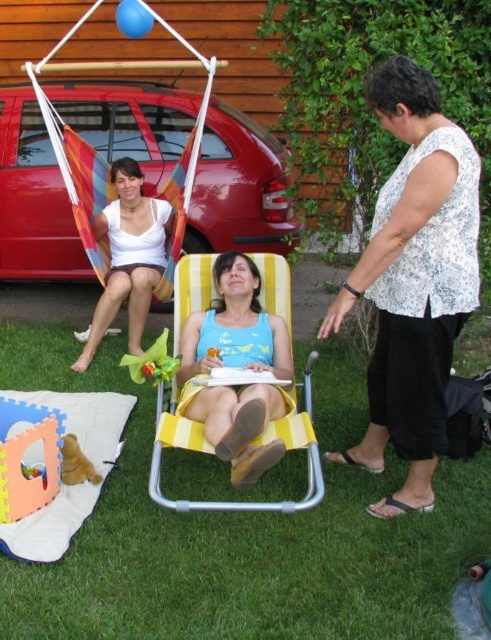
Question: Which object is closer to the camera taking this photo?

Choices:
 (A) white fabric hammock at upper left
 (B) white dotted blouse at center

Answer: (B)

Question: Which object is the farthest from the white fabric hammock at upper left?

Choices:
 (A) yellow plastic toy at center
 (B) yellow fabric beach chair at center
 (C) metallic red car at left

Answer: (B)

Question: Where is white dotted blouse at center located in relation to white fabric hammock at upper left in the image?

Choices:
 (A) left
 (B) right

Answer: (B)

Question: Can you confirm if soft foam play mat at lower left is wider than soft plush teddy bear at lower left?

Choices:
 (A) yes
 (B) no

Answer: (A)

Question: Considering the relative positions of soft foam play mat at lower left and soft plush teddy bear at lower left in the image provided, where is soft foam play mat at lower left located with respect to soft plush teddy bear at lower left?

Choices:
 (A) below
 (B) above

Answer: (B)

Question: Which point is closer to the camera?

Choices:
 (A) (153, 97)
 (B) (60, 451)

Answer: (B)